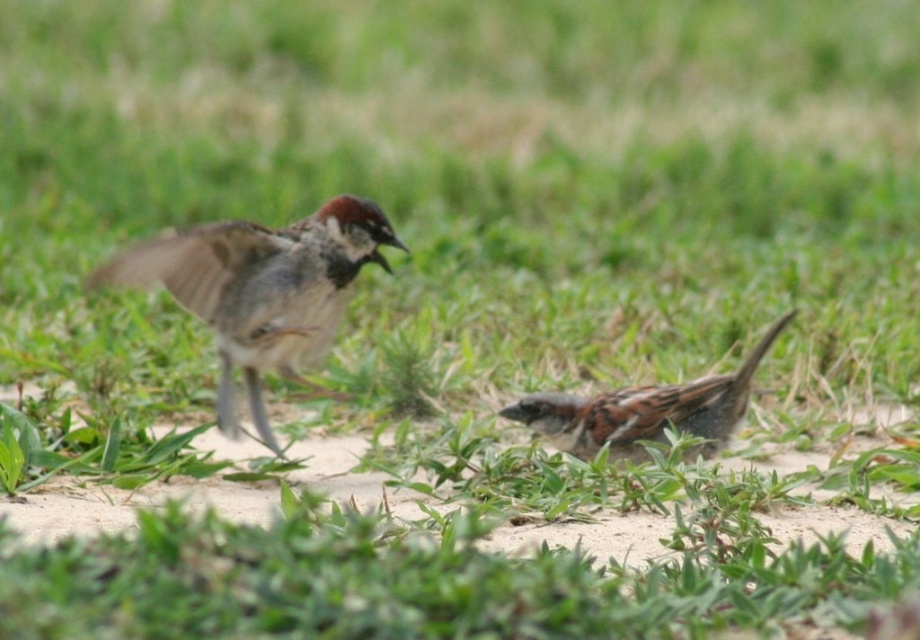
Who is higher up, brown feathered sparrow at left or brown speckled sparrow at lower right?

Positioned higher is brown feathered sparrow at left.

Who is more distant from viewer, (153, 260) or (647, 422)?

The point (647, 422) is behind.

Identify the location of brown feathered sparrow at left. Image resolution: width=920 pixels, height=640 pixels. (260, 289).